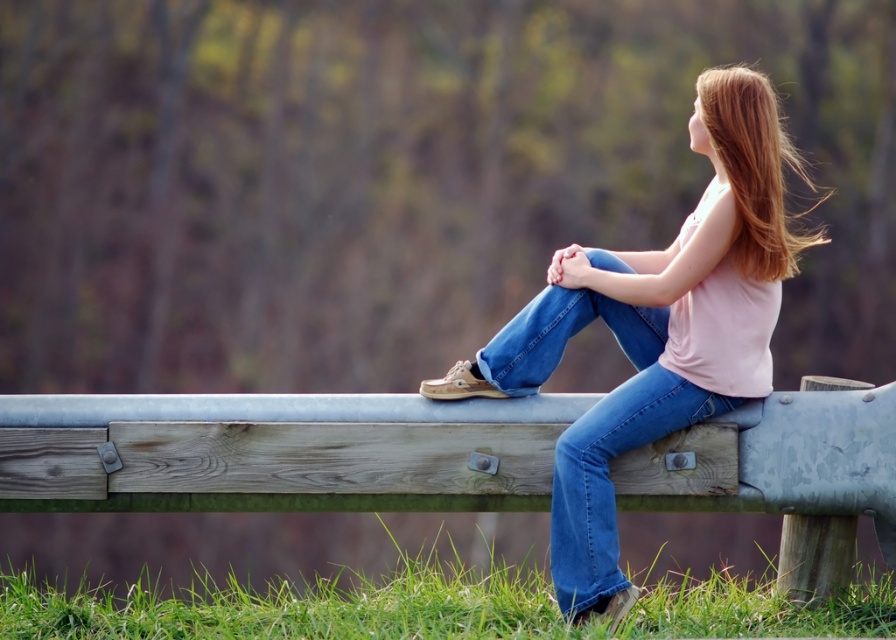
What are the coordinates of the denim jeans at center in the image?

The denim jeans at center are located at coordinates point (x=655, y=330).